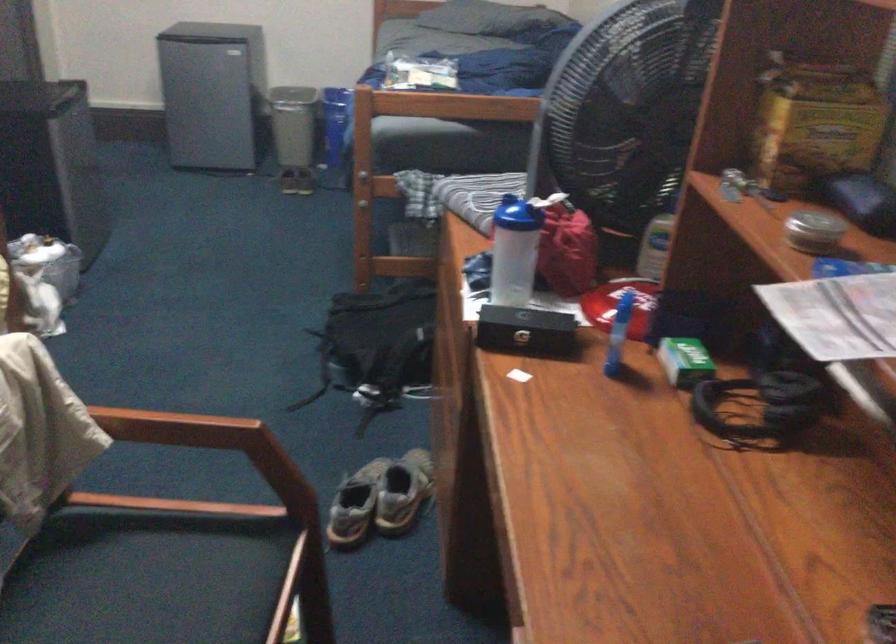
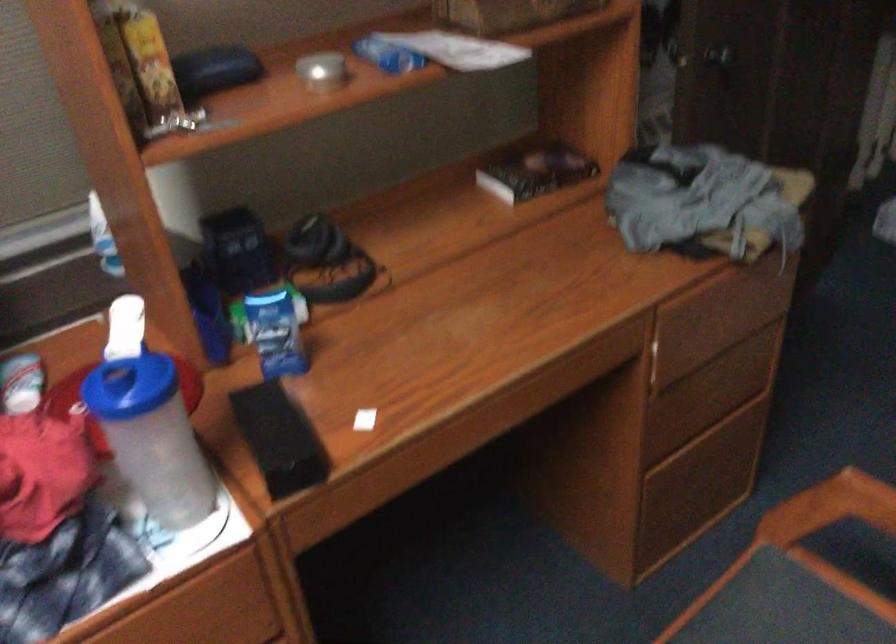
The point at [799,236] is marked in the first image. Where is the corresponding point in the second image?

(322, 71)